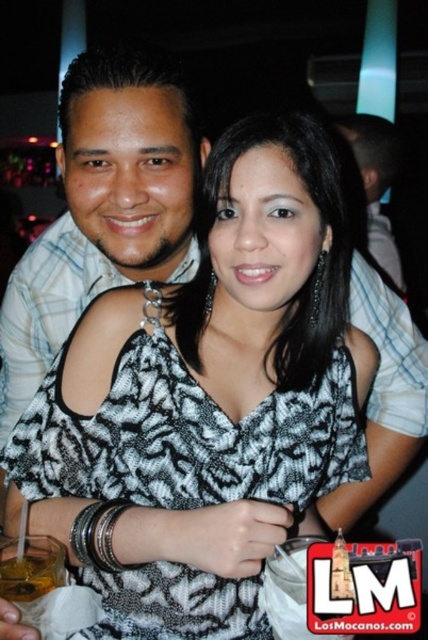
Is black printed fabric dress at center closer to camera compared to translucent plastic cup at lower left?

No, black printed fabric dress at center is further to the viewer.

Between point (172, 417) and point (20, 577), which one is positioned in front?

Point (20, 577)

The height and width of the screenshot is (640, 428). What do you see at coordinates (177, 436) in the screenshot?
I see `black printed fabric dress at center` at bounding box center [177, 436].

Locate an element on the screen. This screenshot has width=428, height=640. black printed fabric dress at center is located at coordinates (177, 436).

Does black printed fabric dress at center have a larger size compared to matte black shirt at upper center?

Yes, black printed fabric dress at center is bigger than matte black shirt at upper center.

Between black printed fabric dress at center and matte black shirt at upper center, which one is positioned higher?

Positioned higher is matte black shirt at upper center.

You are a GUI agent. You are given a task and a screenshot of the screen. Output one action in this format:
    pyautogui.click(x=<x>, y=<y>)
    Task: Click on the black printed fabric dress at center
    The height and width of the screenshot is (640, 428).
    Given the screenshot: What is the action you would take?
    pyautogui.click(x=177, y=436)

Locate an element on the screen. The image size is (428, 640). black printed fabric dress at center is located at coordinates (177, 436).

Which of these two, matte black shirt at upper center or translucent plastic cup at lower left, stands shorter?

translucent plastic cup at lower left is shorter.

Does matte black shirt at upper center appear on the right side of translucent plastic cup at lower left?

Correct, you'll find matte black shirt at upper center to the right of translucent plastic cup at lower left.

Is point (369, 237) behind point (20, 570)?

Yes, point (369, 237) is behind point (20, 570).

You are a GUI agent. You are given a task and a screenshot of the screen. Output one action in this format:
    pyautogui.click(x=<x>, y=<y>)
    Task: Click on the matte black shirt at upper center
    
    Given the screenshot: What is the action you would take?
    pyautogui.click(x=376, y=184)